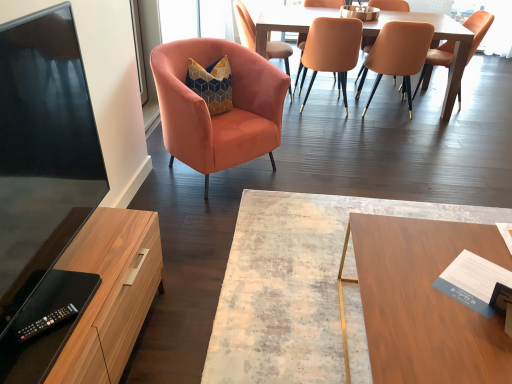
Identify the location of vacant space in between velvet orange armchair at left, the sixth chair viewed from the right, and wooden rectangular table at center. Image resolution: width=512 pixels, height=384 pixels. (274, 185).